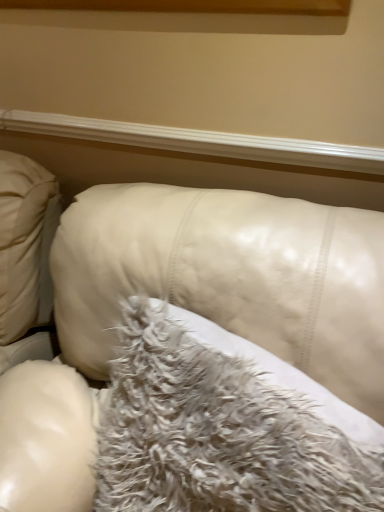
Question: From the image's perspective, is white leather couch at center below fuzzy white pillow at center?

Choices:
 (A) no
 (B) yes

Answer: (B)

Question: From the image's perspective, is white leather couch at center located above fuzzy white pillow at center?

Choices:
 (A) yes
 (B) no

Answer: (B)

Question: Is white leather couch at center taller than fuzzy white pillow at center?

Choices:
 (A) no
 (B) yes

Answer: (B)

Question: Can you confirm if white leather couch at center is thinner than fuzzy white pillow at center?

Choices:
 (A) yes
 (B) no

Answer: (B)

Question: Considering the relative sizes of white leather couch at center and fuzzy white pillow at center in the image provided, is white leather couch at center bigger than fuzzy white pillow at center?

Choices:
 (A) yes
 (B) no

Answer: (A)

Question: Based on their positions, is white glossy wood at upper center located to the left or right of white leather couch at center?

Choices:
 (A) left
 (B) right

Answer: (A)

Question: From a real-world perspective, is white glossy wood at upper center above or below white leather couch at center?

Choices:
 (A) above
 (B) below

Answer: (A)

Question: Considering the positions of white glossy wood at upper center and white leather couch at center in the image, is white glossy wood at upper center taller or shorter than white leather couch at center?

Choices:
 (A) short
 (B) tall

Answer: (A)

Question: Is white glossy wood at upper center bigger or smaller than white leather couch at center?

Choices:
 (A) big
 (B) small

Answer: (B)

Question: From the image's perspective, is white glossy wood at upper center above or below fuzzy white pillow at center?

Choices:
 (A) above
 (B) below

Answer: (A)

Question: Is white glossy wood at upper center taller or shorter than fuzzy white pillow at center?

Choices:
 (A) tall
 (B) short

Answer: (B)

Question: Is white glossy wood at upper center in front of or behind fuzzy white pillow at center in the image?

Choices:
 (A) front
 (B) behind

Answer: (B)

Question: Considering the positions of white glossy wood at upper center and fuzzy white pillow at center in the image, is white glossy wood at upper center wider or thinner than fuzzy white pillow at center?

Choices:
 (A) wide
 (B) thin

Answer: (B)

Question: Do you think white leather couch at center is within fuzzy white pillow at center, or outside of it?

Choices:
 (A) outside
 (B) inside

Answer: (A)

Question: Relative to fuzzy white pillow at center, is white leather couch at center in front or behind?

Choices:
 (A) front
 (B) behind

Answer: (A)